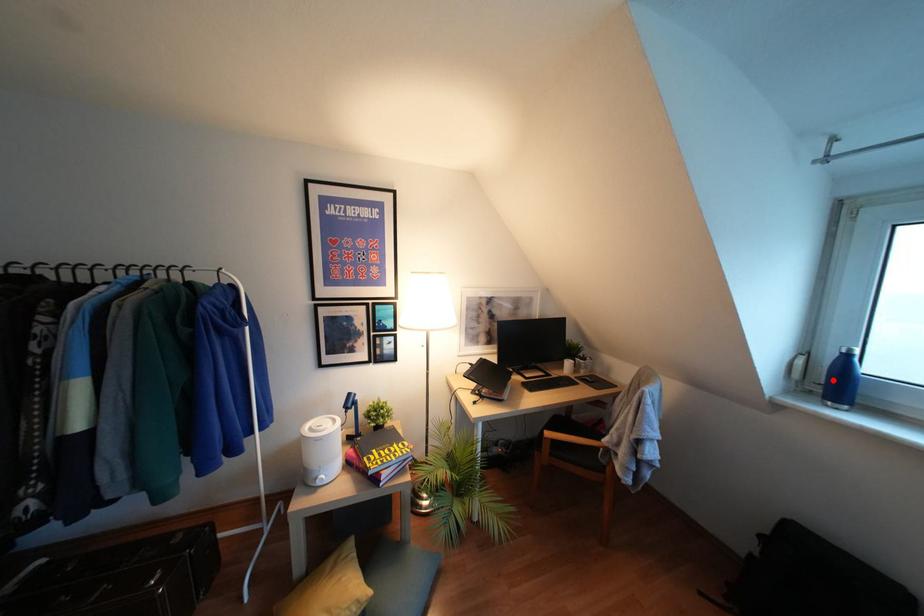
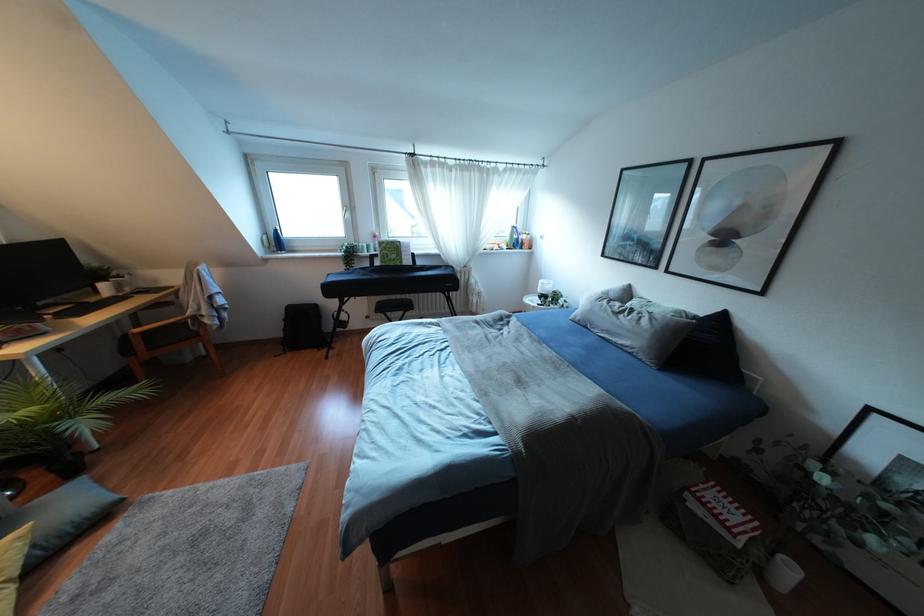
Locate, in the second image, the point that corresponds to the highlighted location in the first image.

(275, 241)